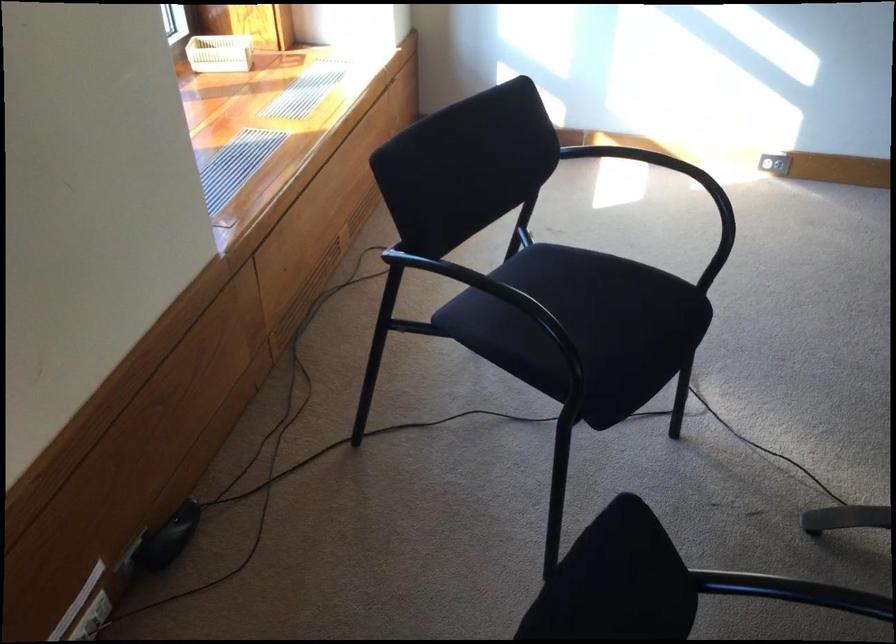
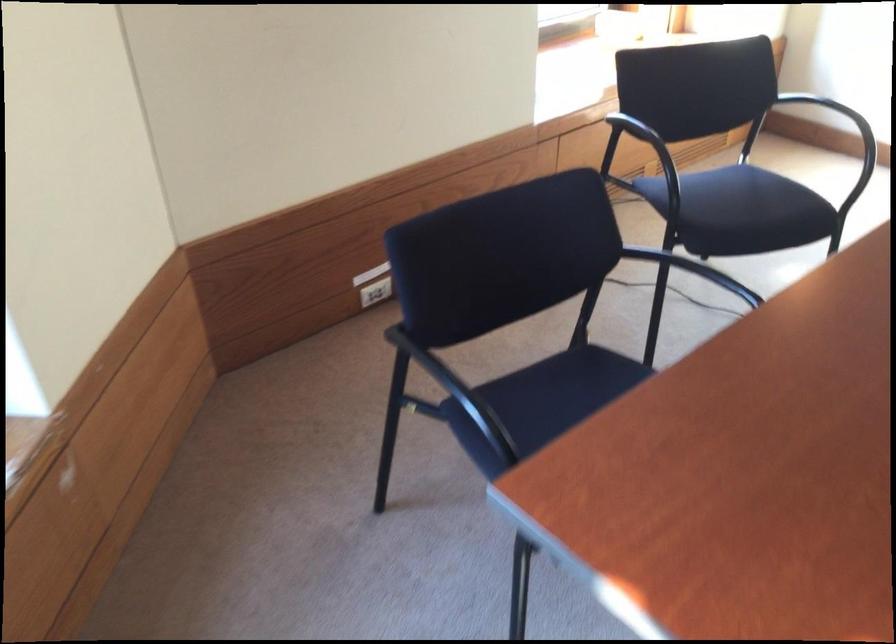
Locate, in the second image, the point that corresponds to point (328, 252) in the first image.

(642, 158)